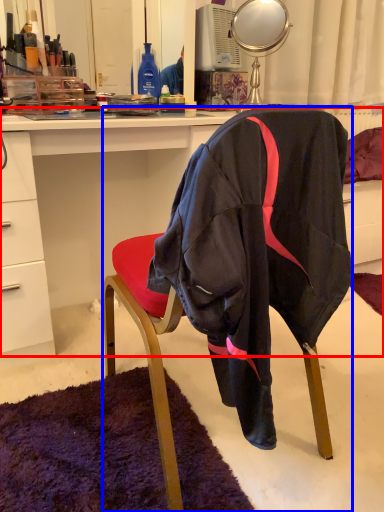
Question: Among these objects, which one is farthest to the camera, desk (highlighted by a red box) or chair (highlighted by a blue box)?

Choices:
 (A) desk
 (B) chair

Answer: (A)